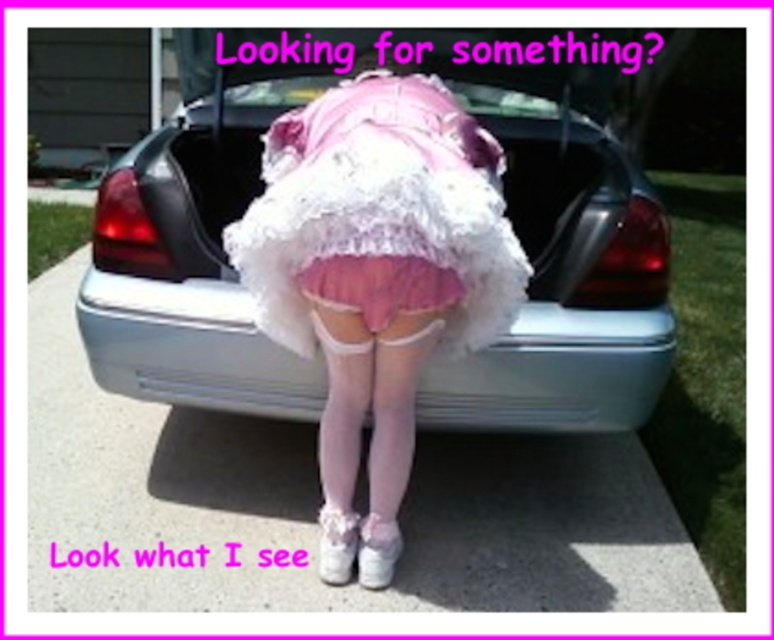
Is white glossy sedan at center below pink satin ballet skirt at center?

Actually, white glossy sedan at center is above pink satin ballet skirt at center.

Which is above, white glossy sedan at center or pink satin ballet skirt at center?

white glossy sedan at center is higher up.

Between point (217, 282) and point (430, 280), which one is positioned in front?

Point (430, 280) is more forward.

The image size is (774, 640). What are the coordinates of `white glossy sedan at center` in the screenshot? It's located at (562, 268).

Measure the distance from white glossy sedan at center to fuzzy white skirt at center.

A distance of 10.71 inches exists between white glossy sedan at center and fuzzy white skirt at center.

How much distance is there between white glossy sedan at center and fuzzy white skirt at center?

white glossy sedan at center is 10.71 inches away from fuzzy white skirt at center.

Find the location of `white glossy sedan at center`. white glossy sedan at center is located at coordinates (562, 268).

Is fuzzy white skirt at center thinner than pink satin ballet skirt at center?

In fact, fuzzy white skirt at center might be wider than pink satin ballet skirt at center.

Does fuzzy white skirt at center appear over pink satin ballet skirt at center?

Actually, fuzzy white skirt at center is below pink satin ballet skirt at center.

Which is behind, point (307, 196) or point (331, 280)?

Point (331, 280)

Locate an element on the screen. The image size is (774, 640). fuzzy white skirt at center is located at coordinates (375, 276).